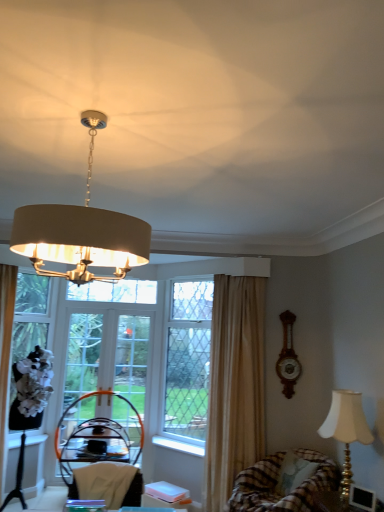
Question: Is white fabric armchair at lower center, the 2th armchair in the back-to-front sequence, at the right side of clear glass window screen at left, acting as the first window screen starting from the left?

Choices:
 (A) no
 (B) yes

Answer: (B)

Question: Is clear glass window screen at left, the second window screen positioned from the right, a part of white fabric armchair at lower center, which appears as the 1th armchair when viewed from the front?

Choices:
 (A) no
 (B) yes

Answer: (A)

Question: From the image's perspective, does white fabric armchair at lower center, the 2th armchair in the back-to-front sequence, appear lower than clear glass window screen at left, acting as the first window screen starting from the left?

Choices:
 (A) yes
 (B) no

Answer: (A)

Question: Would you say white fabric armchair at lower center, positioned as the 1th armchair in top-to-bottom order, is outside clear glass window screen at left, acting as the first window screen starting from the left?

Choices:
 (A) yes
 (B) no

Answer: (A)

Question: Considering the relative sizes of white fabric armchair at lower center, which is the 2th armchair in bottom-to-top order, and clear glass window screen at left, acting as the first window screen starting from the left, in the image provided, is white fabric armchair at lower center, which is the 2th armchair in bottom-to-top order, shorter than clear glass window screen at left, acting as the first window screen starting from the left,?

Choices:
 (A) yes
 (B) no

Answer: (A)

Question: Based on their sizes in the image, would you say plaid fabric swivel chair at lower right is bigger or smaller than wooden clock at right?

Choices:
 (A) small
 (B) big

Answer: (B)

Question: From a real-world perspective, relative to wooden clock at right, is plaid fabric swivel chair at lower right vertically above or below?

Choices:
 (A) above
 (B) below

Answer: (B)

Question: Does point (273, 506) appear closer or farther from the camera than point (283, 367)?

Choices:
 (A) closer
 (B) farther

Answer: (A)

Question: Is plaid fabric swivel chair at lower right taller or shorter than wooden clock at right?

Choices:
 (A) tall
 (B) short

Answer: (B)

Question: Do you think white plastic window sill at lower center, marked as the 1th window sill in a right-to-left arrangement, is within white fabric armchair at lower center, positioned as the 1th armchair in top-to-bottom order, or outside of it?

Choices:
 (A) inside
 (B) outside

Answer: (B)

Question: In the image, is white plastic window sill at lower center, marked as the 1th window sill in a right-to-left arrangement, positioned in front of or behind white fabric armchair at lower center, positioned as the 1th armchair in top-to-bottom order?

Choices:
 (A) front
 (B) behind

Answer: (B)

Question: From the image's perspective, is white plastic window sill at lower center, the 2th window sill viewed from the left, located above or below white fabric armchair at lower center, the 2th armchair in the back-to-front sequence?

Choices:
 (A) below
 (B) above

Answer: (A)

Question: Is white plastic window sill at lower center, marked as the 1th window sill in a right-to-left arrangement, bigger or smaller than white fabric armchair at lower center, the 2th armchair in the back-to-front sequence?

Choices:
 (A) big
 (B) small

Answer: (B)

Question: From the image's perspective, is white glass screen door at center, the 1th screen door when ordered from left to right, positioned above or below beige fabric curtain at center?

Choices:
 (A) above
 (B) below

Answer: (B)

Question: From a real-world perspective, relative to beige fabric curtain at center, is white glass screen door at center, the 1th screen door when ordered from left to right, vertically above or below?

Choices:
 (A) below
 (B) above

Answer: (A)